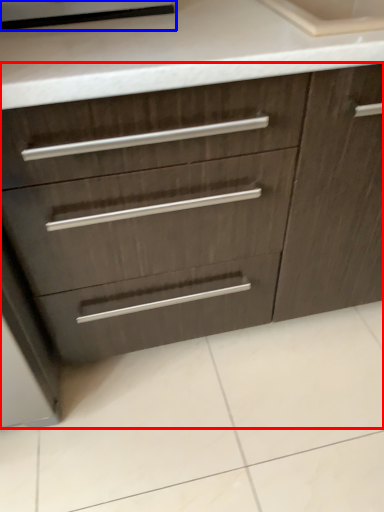
Question: Among these objects, which one is nearest to the camera, chest of drawers (highlighted by a red box) or appliance (highlighted by a blue box)?

Choices:
 (A) chest of drawers
 (B) appliance

Answer: (A)